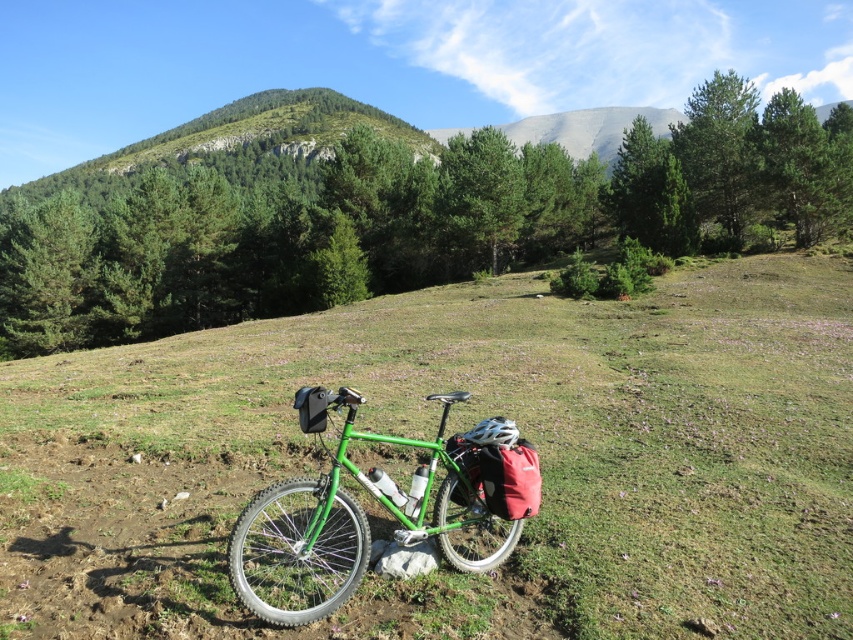
You are a hiker who wants to place a 10 cm wide tent on the green matte grass at center. Can you confirm if there is enough space for the tent on the grass?

The position of green matte grass at center is at point (461, 429), but the description does not provide the size or area of the grass. Therefore, it is unclear if there is enough space for the tent.

You are a hiker planning to walk from the green matte grass at center towards the green matte bicycle at center. Is the bicycle in front of or behind the grass from your perspective?

The green matte bicycle at center is behind the green matte grass at center, so from your perspective, the bicycle is behind the grass.

You are planning to take a photo of the green matte bicycle at center and the green matte grass at center. Which object would you focus on if you want the bicycle to be the main subject while keeping the grass in the background slightly blurred?

To focus on the green matte bicycle at center and blur the green matte grass at center, adjust the camera to have a shallow depth of field, ensuring the bicycle is in sharp focus while the grass remains in the background slightly out of focus.